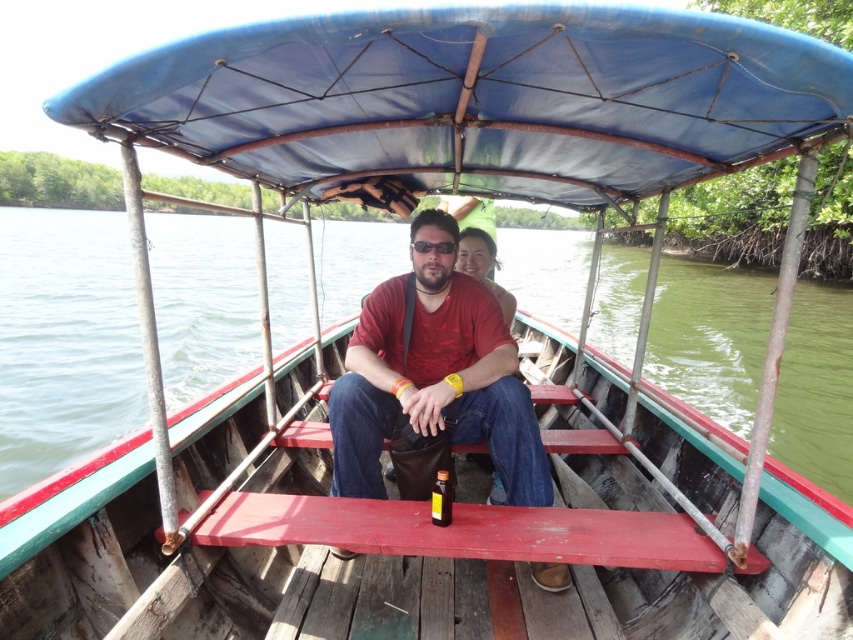
Question: Which point appears closest to the camera in this image?

Choices:
 (A) (438, 508)
 (B) (177, 241)
 (C) (670, 74)
 (D) (473, 417)

Answer: (C)

Question: Can you confirm if blue fabric canopy at center is thinner than translucent amber bottle at center?

Choices:
 (A) yes
 (B) no

Answer: (B)

Question: Which point appears closest to the camera in this image?

Choices:
 (A) (115, 240)
 (B) (432, 515)

Answer: (B)

Question: Among these objects, which one is farthest from the camera?

Choices:
 (A) blue fabric canopy at center
 (B) green water at boat center
 (C) matte red shirt at center
 (D) translucent amber bottle at center

Answer: (D)

Question: Does matte red shirt at center have a larger size compared to translucent amber bottle at center?

Choices:
 (A) no
 (B) yes

Answer: (B)

Question: Is matte red shirt at center bigger than translucent amber bottle at center?

Choices:
 (A) no
 (B) yes

Answer: (B)